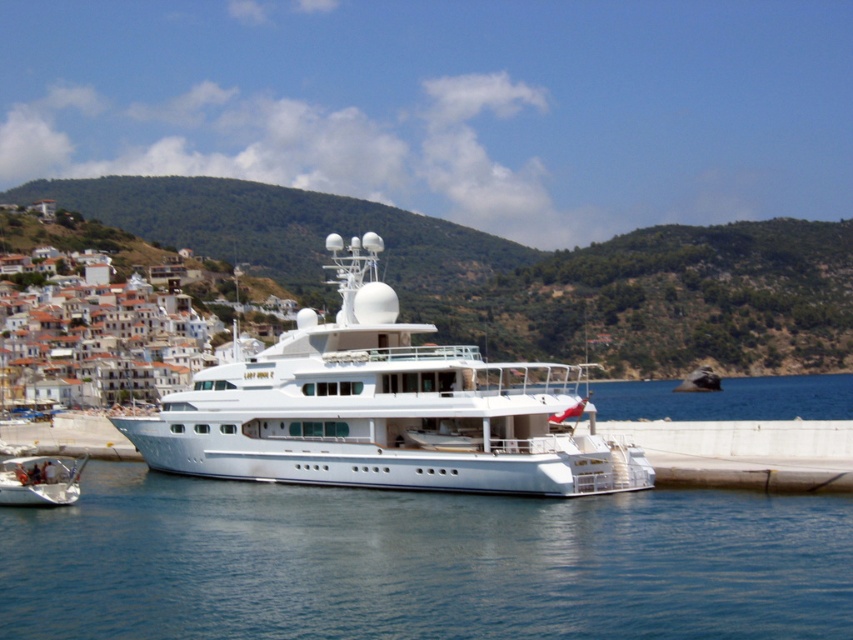
You are standing on the deck of the yacht and looking towards the green leafy hillside at upper left. To your left, you see the transparent blue water at lower center. Which object is closer to your left side?

The transparent blue water at lower center is to the left of the green leafy hillside at upper left, so it is closer to your left side.

You are a photographer standing on the dock and want to take a photo of both the white glossy cruise ship at center and the white glossy dinghy at lower left. Which object should you focus on first to ensure it appears sharp in the foreground?

You should focus on the white glossy cruise ship at center first because it is closer to you than the white glossy dinghy at lower left, making it the foreground object.

You are a photographer planning to capture the white glossy cruise ship at center and the white glossy dinghy at lower left in a single shot. Based on their positions, which object should you position closer to the left edge of your camera frame to include both in the composition?

To include both the white glossy cruise ship at center and the white glossy dinghy at lower left in the composition, you should position the white glossy dinghy at lower left closer to the left edge of the frame since it is located to the left of the cruise ship.